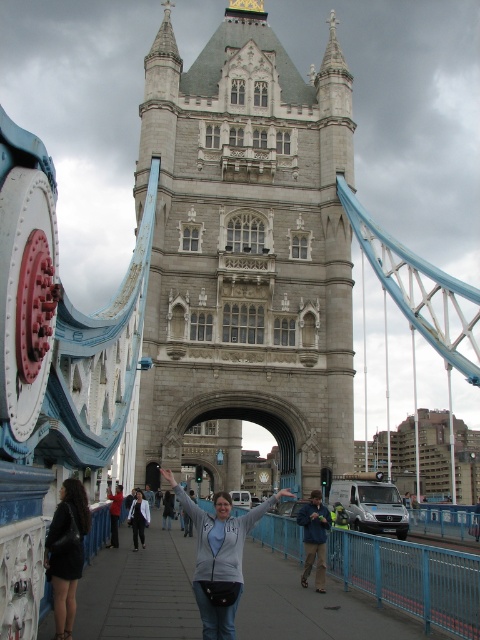
You are standing at the center of the Tower Bridge walkway and see the black leather jacket at lower left. If you want to reach the jacket, should you walk towards the left or right side of the bridge?

Since the black leather jacket at lower left is located at point (x=67, y=554), which is closer to the right side of the bridge, you should walk towards the right side of the bridge to reach it.

Looking at this image, you are a photographer standing on Tower Bridge and want to take a picture of the two people wearing the gray fleece jacket at center and the light gray sweater at center. Which one will appear larger in your photo?

The gray fleece jacket at center will appear larger in the photo because it is closer to the viewer than the light gray sweater at center.

You are a photographer standing on the walkway of Tower Bridge, and you want to take a photo of both the black leather jacket at lower left and the light gray sweater at center. Which object should you adjust your camera to focus on first if you want to capture both in the frame?

The black leather jacket at lower left is to the left of the light gray sweater at center, so you should focus on the black leather jacket at lower left first to ensure both are in the frame.